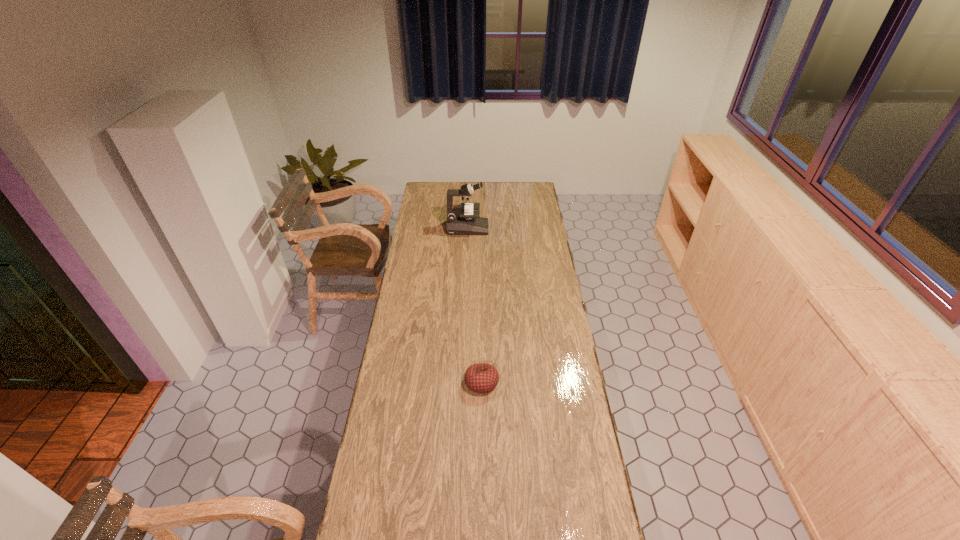
Locate an element on the screen. The width and height of the screenshot is (960, 540). the farther object is located at coordinates (461, 219).

What are the coordinates of `microscope` in the screenshot? It's located at (461, 219).

You are a GUI agent. You are given a task and a screenshot of the screen. Output one action in this format:
    pyautogui.click(x=<x>, y=<y>)
    Task: Click on the beanbag
    The width and height of the screenshot is (960, 540).
    Given the screenshot: What is the action you would take?
    pyautogui.click(x=481, y=378)

Locate an element on the screen. This screenshot has width=960, height=540. the nearer object is located at coordinates (481, 378).

The image size is (960, 540). I want to click on free spot located through the eyepieces of the taller object, so point(500,228).

Where is `vacant space located on the front of the nearer object`? vacant space located on the front of the nearer object is located at coordinates (482, 469).

The height and width of the screenshot is (540, 960). What are the coordinates of `free region at the left edge` in the screenshot? It's located at (433, 212).

In the image, there is a desktop. Where is `free region at the right edge`? The height and width of the screenshot is (540, 960). free region at the right edge is located at coordinates (542, 356).

In the image, there is a desktop. At what (x,y) coordinates should I click in order to perform the action: click on vacant space at the far left corner. Please return your answer as a coordinate pair (x, y). Looking at the image, I should click on (435, 190).

This screenshot has height=540, width=960. I want to click on free spot at the far right corner of the desktop, so pyautogui.click(x=520, y=183).